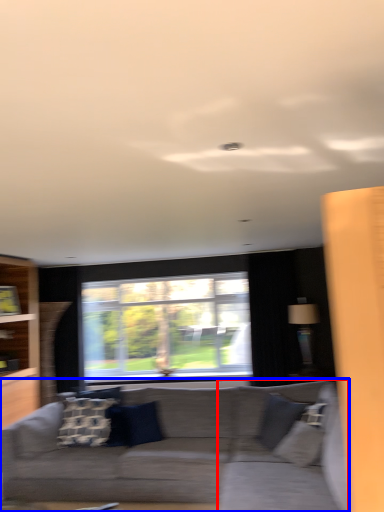
Question: Which of the following is the closest to the observer, swivel chair (highlighted by a red box) or studio couch (highlighted by a blue box)?

Choices:
 (A) swivel chair
 (B) studio couch

Answer: (B)